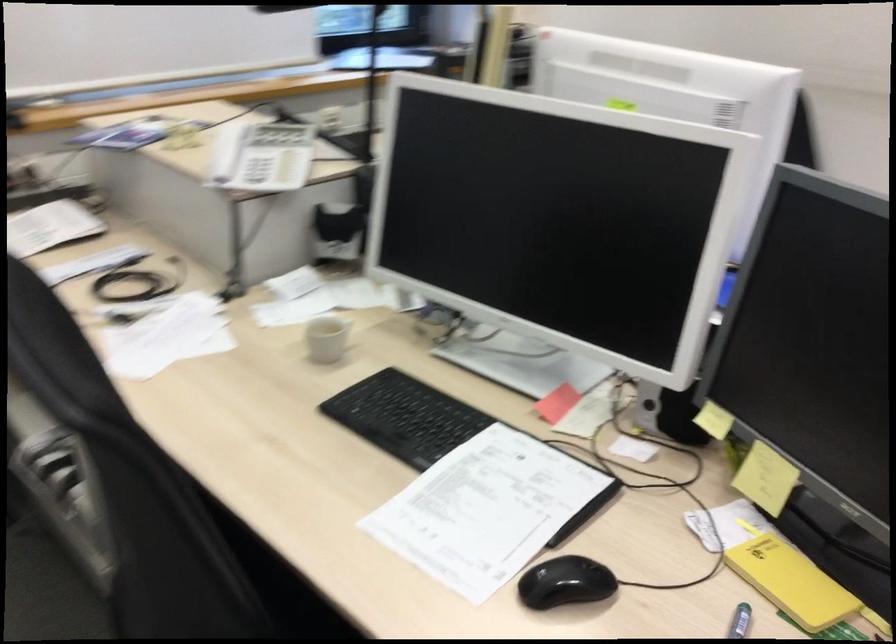
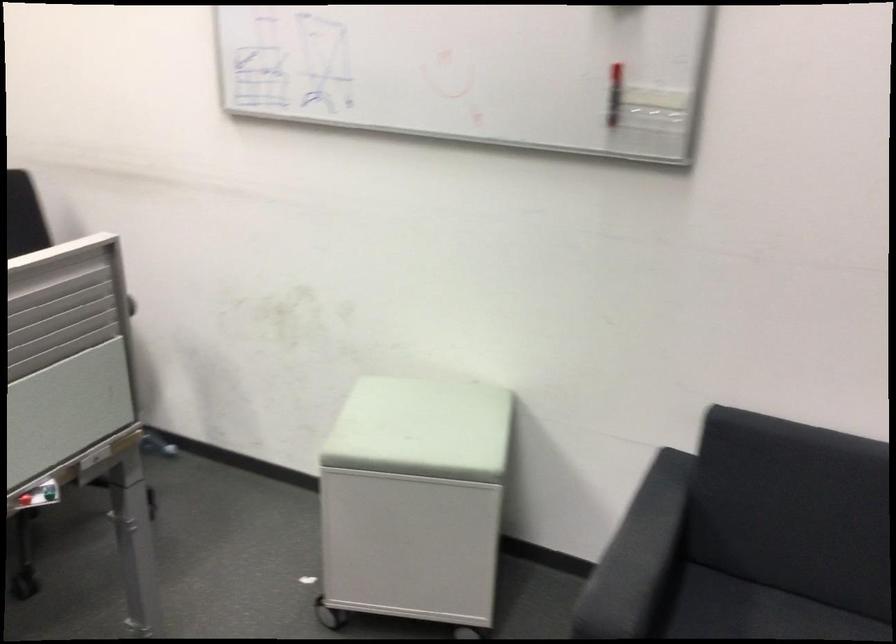
Question: The images are taken continuously from a first-person perspective. In which direction are you moving?

Choices:
 (A) Left
 (B) Right
 (C) Forward
 (D) Backward

Answer: (B)